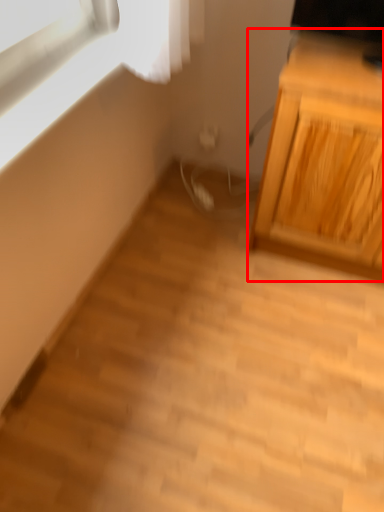
Question: Where is cabinetry (annotated by the red box) located in relation to window in the image?

Choices:
 (A) left
 (B) right

Answer: (B)